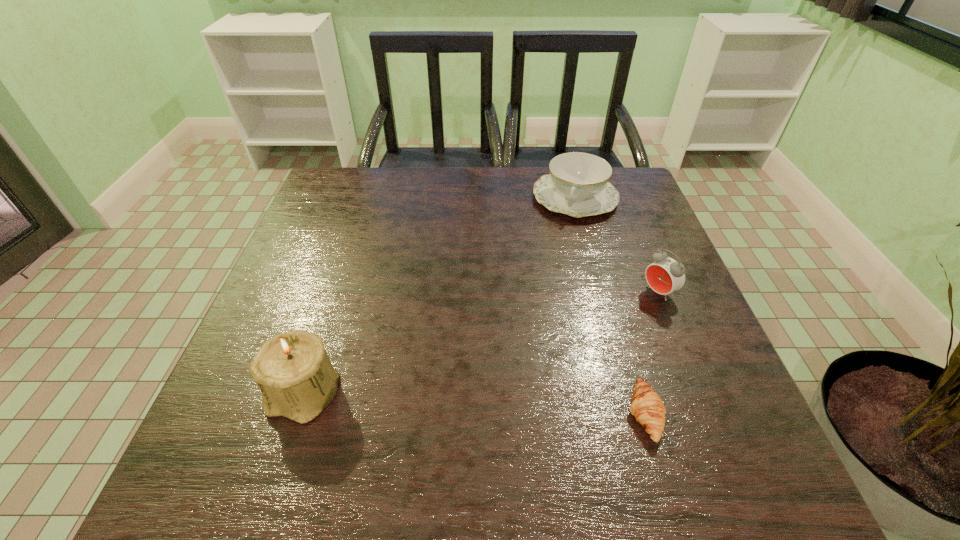
Where is `vacant space that is in between the chinaware and the pastry`? vacant space that is in between the chinaware and the pastry is located at coordinates (610, 306).

I want to click on free spot between the farthest object and the leftmost object, so click(x=439, y=295).

Identify the location of free spot between the candle_holder and the third nearest object. This screenshot has width=960, height=540. (481, 342).

What are the coordinates of `vacant point located between the third shortest object and the tallest object` in the screenshot? It's located at (481, 342).

The height and width of the screenshot is (540, 960). In order to click on free space between the leftmost object and the chinaware in this screenshot , I will do `click(439, 295)`.

Locate an element on the screen. free space between the alarm clock and the third tallest object is located at coordinates (617, 245).

Find the location of `free space that is in between the leftmost object and the third tallest object`. free space that is in between the leftmost object and the third tallest object is located at coordinates (439, 295).

This screenshot has height=540, width=960. I want to click on free spot between the chinaware and the alarm clock, so click(617, 245).

Locate an element on the screen. The width and height of the screenshot is (960, 540). unoccupied area between the tallest object and the alarm clock is located at coordinates (481, 342).

Find the location of a particular element. The height and width of the screenshot is (540, 960). free space between the shortest object and the third shortest object is located at coordinates tap(652, 353).